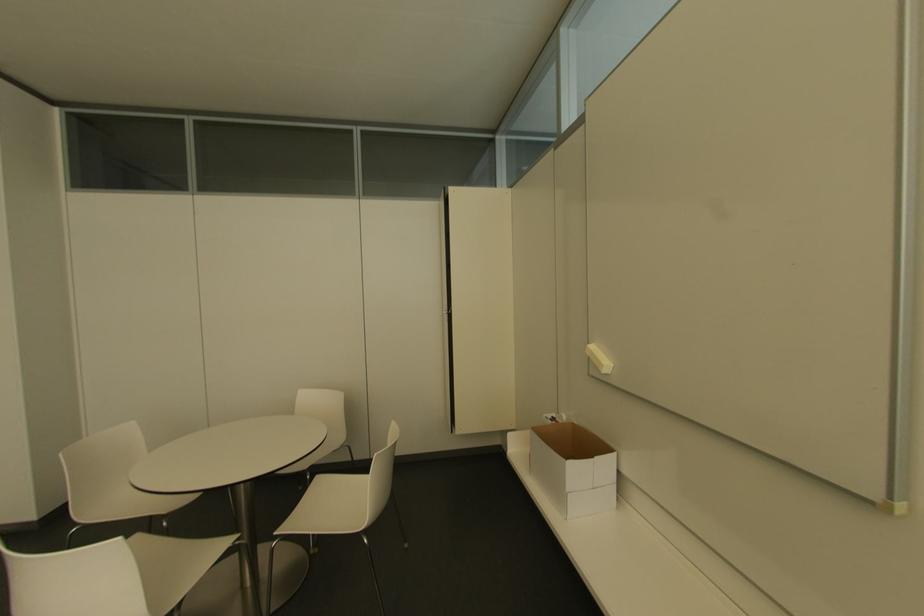
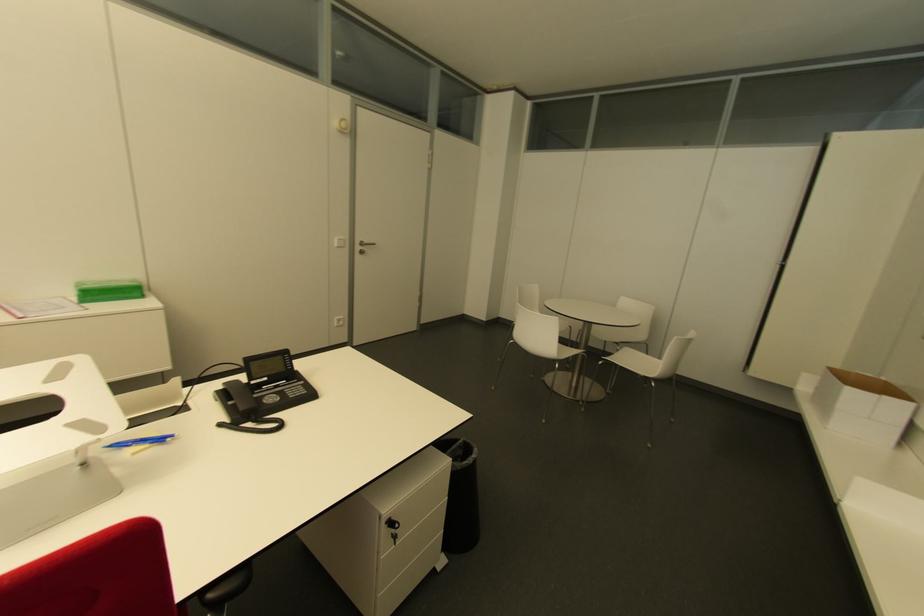
The point at (551, 415) is marked in the first image. Where is the corresponding point in the second image?

(868, 376)